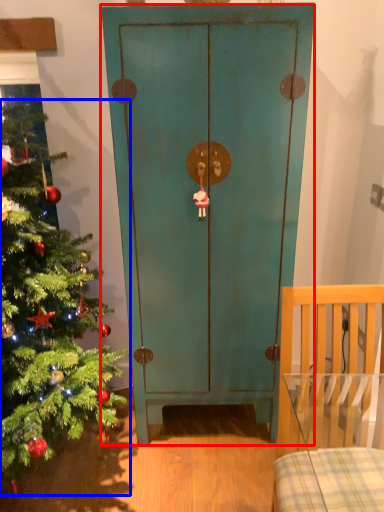
Question: Which point is closer to the camera, door (highlighted by a red box) or christmas tree (highlighted by a blue box)?

Choices:
 (A) door
 (B) christmas tree

Answer: (B)